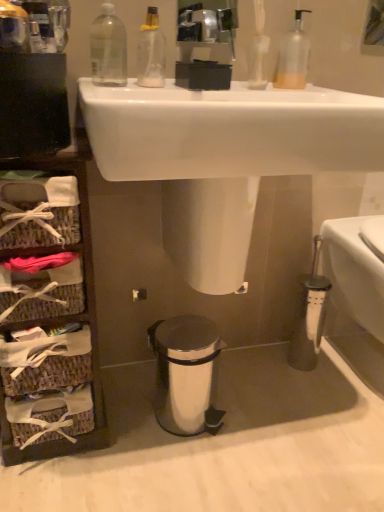
The image size is (384, 512). I want to click on free point below silver metallic trash can at lower center (from a real-world perspective), so click(x=185, y=417).